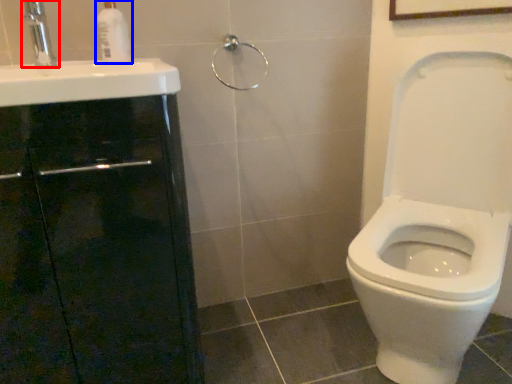
Question: Which point is closer to the camera, tap (highlighted by a red box) or soap dispenser (highlighted by a blue box)?

Choices:
 (A) tap
 (B) soap dispenser

Answer: (A)